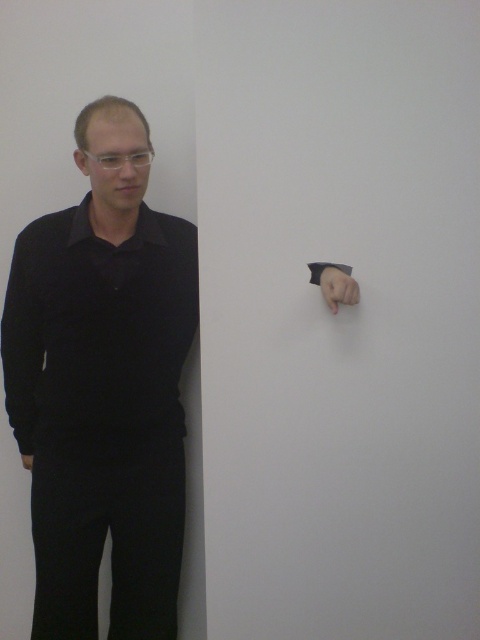
Question: Does black smooth shirt at left have a lesser width compared to matte black hand at upper right?

Choices:
 (A) no
 (B) yes

Answer: (A)

Question: Is black smooth shirt at left to the left of matte black hand at upper right from the viewer's perspective?

Choices:
 (A) no
 (B) yes

Answer: (B)

Question: Which point is closer to the camera taking this photo?

Choices:
 (A) coord(29,285)
 (B) coord(337,272)
 (C) coord(105,310)

Answer: (B)

Question: Which point is closer to the camera taking this photo?

Choices:
 (A) (325, 266)
 (B) (12, 362)

Answer: (A)

Question: Considering the real-world distances, which object is closest to the black matte shirt at left?

Choices:
 (A) matte black hand at upper right
 (B) black smooth shirt at left

Answer: (B)

Question: Is black smooth shirt at left bigger than matte black hand at upper right?

Choices:
 (A) no
 (B) yes

Answer: (B)